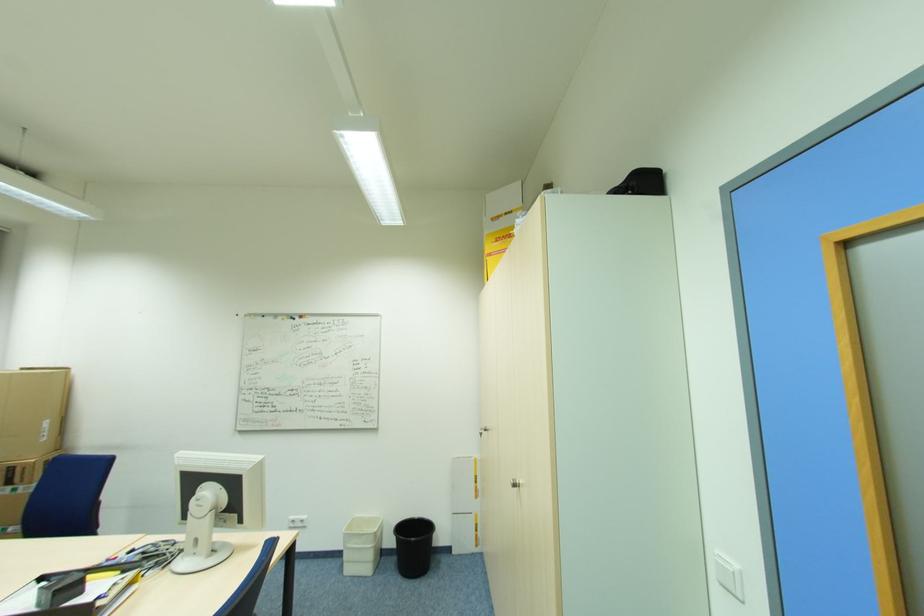
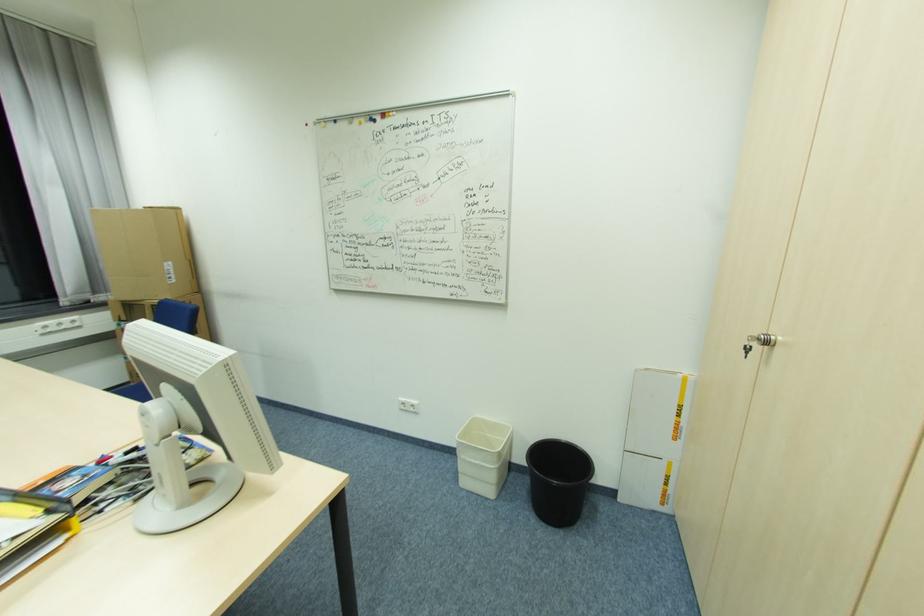
In the second image, find the point that corresponds to (254,466) in the first image.

(207, 371)